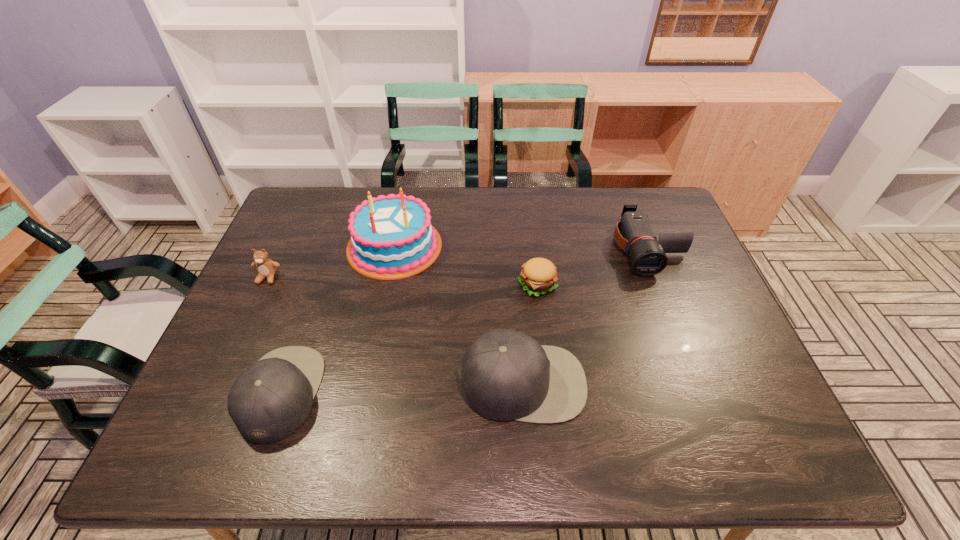
The image size is (960, 540). I want to click on free spot at the near edge of the desktop, so click(x=324, y=403).

This screenshot has height=540, width=960. What are the coordinates of `free space at the left edge of the desktop` in the screenshot? It's located at (266, 279).

Identify the location of vacant space at the right edge of the desktop. The image size is (960, 540). (689, 292).

Locate an element on the screen. Image resolution: width=960 pixels, height=540 pixels. free point at the far left corner is located at coordinates (302, 221).

The image size is (960, 540). Find the location of `vacant area between the teddy bear and the taller cap`. vacant area between the teddy bear and the taller cap is located at coordinates (395, 330).

Where is `unoccupied position between the tallest object and the shorter cap`? unoccupied position between the tallest object and the shorter cap is located at coordinates (338, 320).

Image resolution: width=960 pixels, height=540 pixels. Find the location of `empty space that is in between the teddy bear and the birthday cake`. empty space that is in between the teddy bear and the birthday cake is located at coordinates (331, 262).

Where is `vacant space that is in between the taller cap and the leftmost object`? The width and height of the screenshot is (960, 540). vacant space that is in between the taller cap and the leftmost object is located at coordinates (395, 330).

What are the coordinates of `free area in between the left cap and the camcorder` in the screenshot? It's located at (465, 321).

Where is `unoccupied area between the second tallest object and the leftmost object`? The height and width of the screenshot is (540, 960). unoccupied area between the second tallest object and the leftmost object is located at coordinates (395, 330).